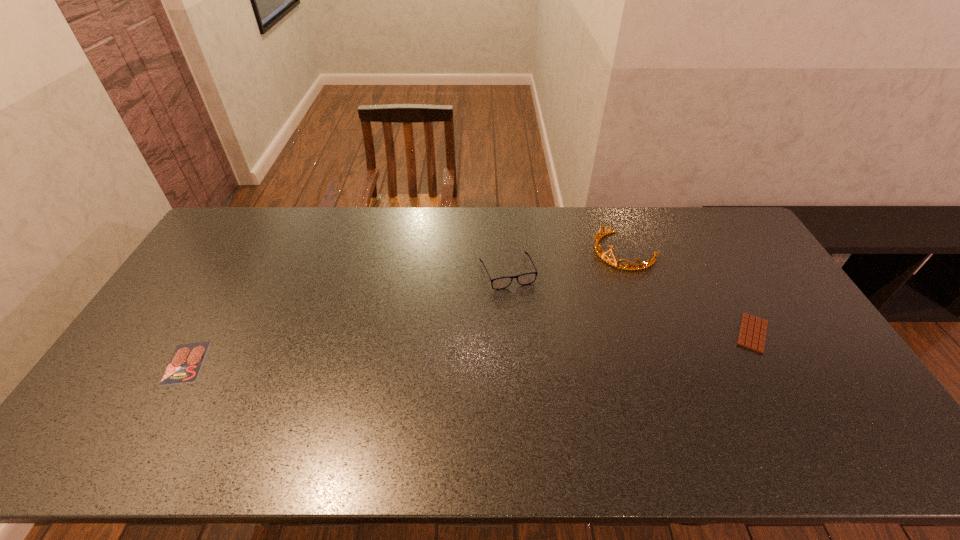
Where is `the shortest object`? the shortest object is located at coordinates (184, 366).

Image resolution: width=960 pixels, height=540 pixels. I want to click on the leftmost object, so click(x=184, y=366).

The image size is (960, 540). In order to click on the rightmost object in this screenshot , I will do `click(752, 335)`.

Identify the location of candy bar. The image size is (960, 540). (752, 335).

I want to click on the tallest object, so click(x=601, y=255).

Identify the location of the third object from left to right. The height and width of the screenshot is (540, 960). (601, 255).

Where is `spectacles`? The image size is (960, 540). spectacles is located at coordinates (524, 279).

You are a GUI agent. You are given a task and a screenshot of the screen. Output one action in this format:
    pyautogui.click(x=<x>, y=<y>)
    Task: Click on the third object from right to left
    This screenshot has height=540, width=960.
    Given the screenshot: What is the action you would take?
    pyautogui.click(x=524, y=279)

Find the location of a particular element. This screenshot has height=540, width=960. vacant area located 0.250m on the right of the leftmost object is located at coordinates (297, 362).

Locate an element on the screen. The image size is (960, 540). blank area located 0.150m on the front of the rightmost object is located at coordinates (792, 403).